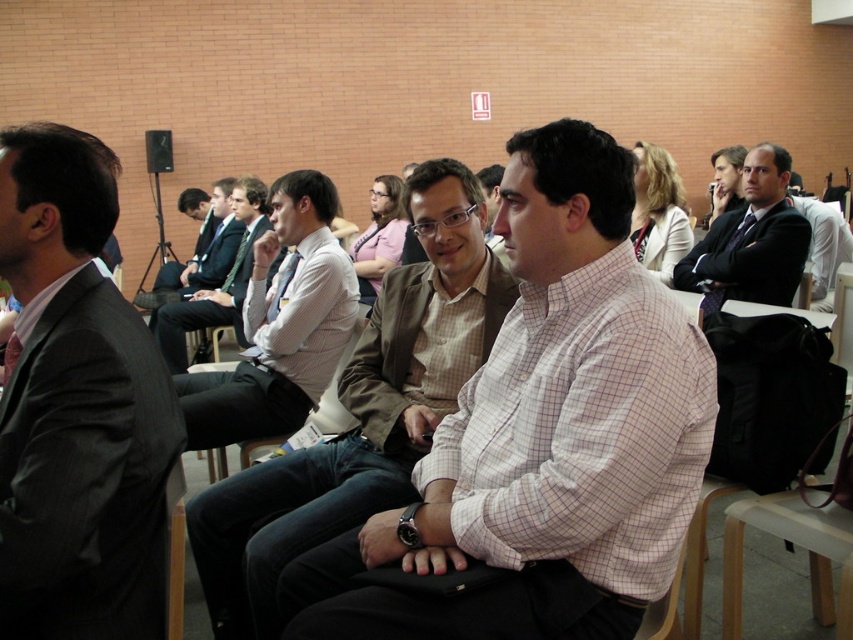
Can you confirm if white shirt at center is shorter than matte white shirt at center?

Yes, white shirt at center is shorter than matte white shirt at center.

Can you confirm if white shirt at center is positioned to the right of matte white shirt at center?

Yes, white shirt at center is to the right of matte white shirt at center.

Between point (251, 314) and point (171, 320), which one is positioned in front?

Point (251, 314) is in front.

This screenshot has height=640, width=853. Find the location of `white shirt at center`. white shirt at center is located at coordinates (280, 324).

Does dark gray suit at left have a smaller size compared to light brown textured blazer at center?

Yes, dark gray suit at left is smaller than light brown textured blazer at center.

Which is in front, point (138, 486) or point (407, 188)?

Point (138, 486) is more forward.

The image size is (853, 640). In order to click on dark gray suit at left in this screenshot , I will do tap(77, 408).

Is white shirt at center positioned in front of dark suit at center?

Yes, white shirt at center is closer to the viewer.

Is white shirt at center to the right of dark suit at center from the viewer's perspective?

Incorrect, white shirt at center is not on the right side of dark suit at center.

The image size is (853, 640). Find the location of `white shirt at center`. white shirt at center is located at coordinates (280, 324).

I want to click on white shirt at center, so click(x=280, y=324).